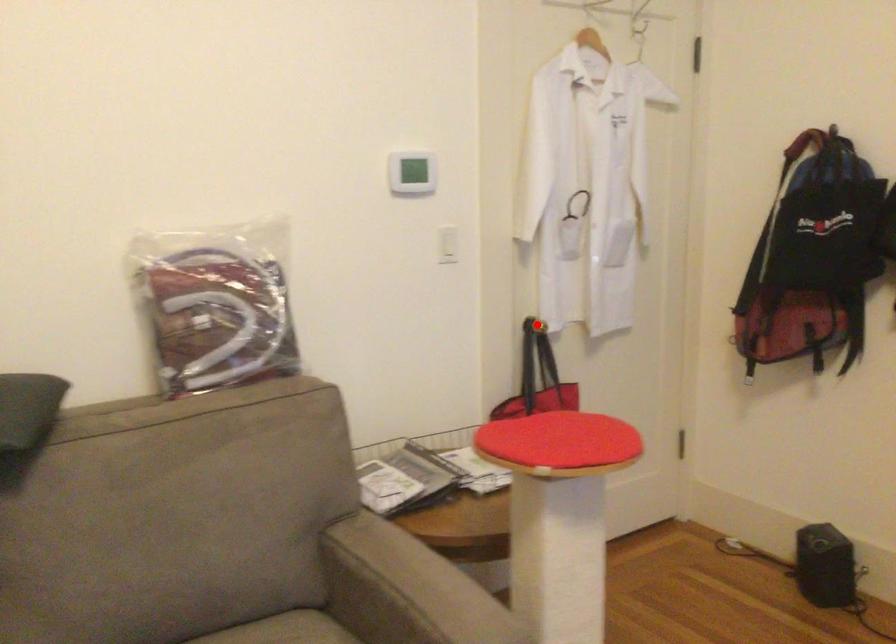
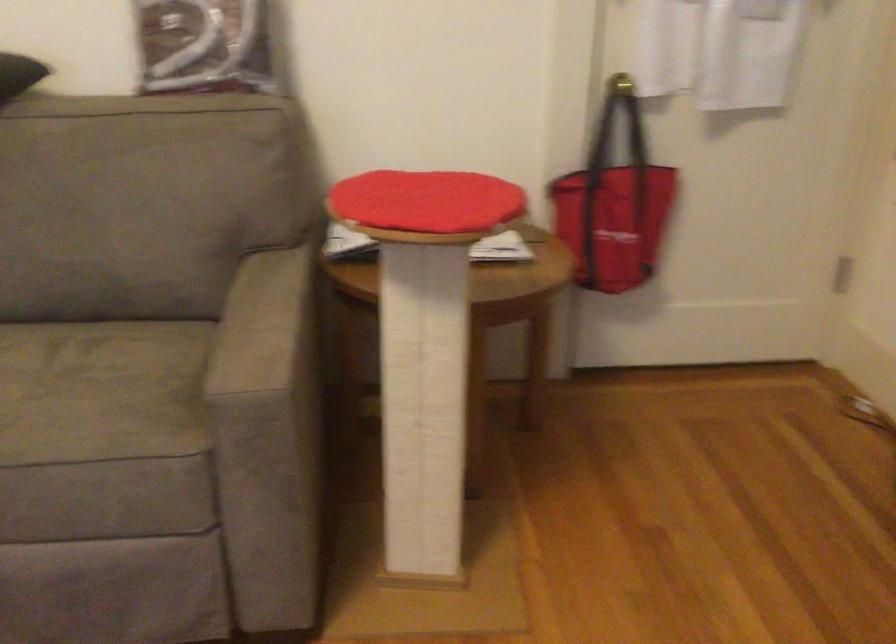
Question: I am providing you with two images of the same scene from different viewpoints. In image1, a red point is highlighted. Considering the same 3D point in image2, which of the following is correct?

Choices:
 (A) It is closer
 (B) It is farther

Answer: (A)